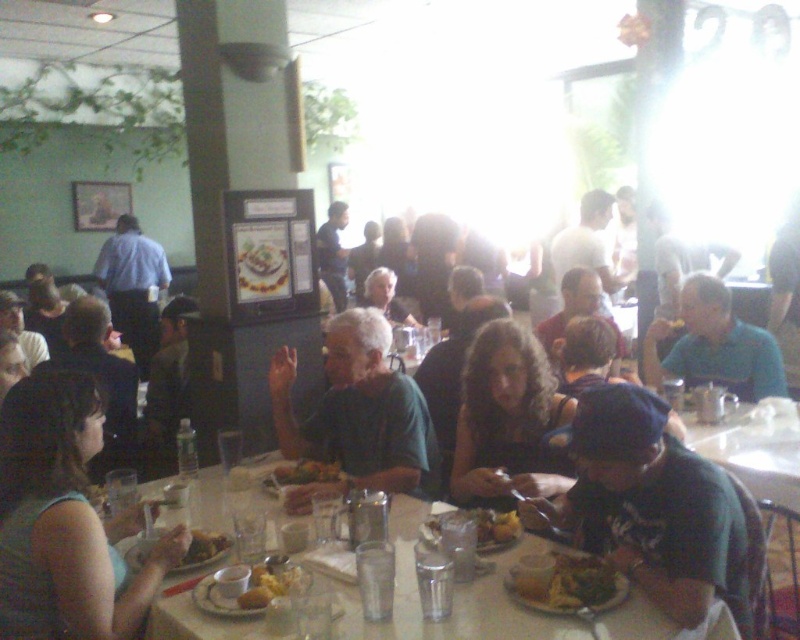
You are a waiter at the restaurant and need to deliver a drink to the customer sitting at the table with both the matte green shirt at center and the green leafy salad at center. Which object should you use to determine the customer seat location?

The matte green shirt at center is much taller than the green leafy salad at center, so you should use the matte green shirt at center to locate the customer seat because it is more visible due to its height.

You are a waiter at the restaurant. You need to deliver a drink to the customer wearing the matte green shirt at center without spilling it. The drink is placed on the table where the green leafy salad at center is also present. Considering their sizes, which item should you avoid bumping into when placing the drink?

The matte green shirt at center has a larger size compared to the green leafy salad at center, so you should avoid bumping into the matte green shirt at center to prevent spilling the drink.